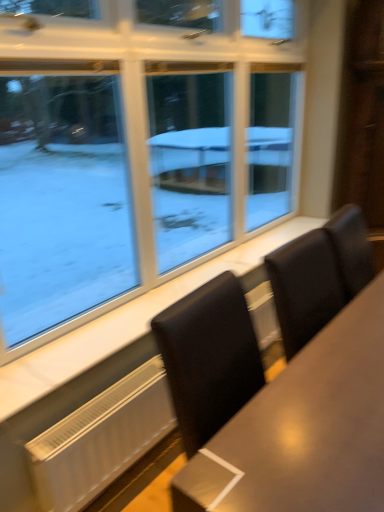
This screenshot has height=512, width=384. I want to click on empty space that is ontop of white matte radiator at lower left (from a real-world perspective), so click(x=104, y=403).